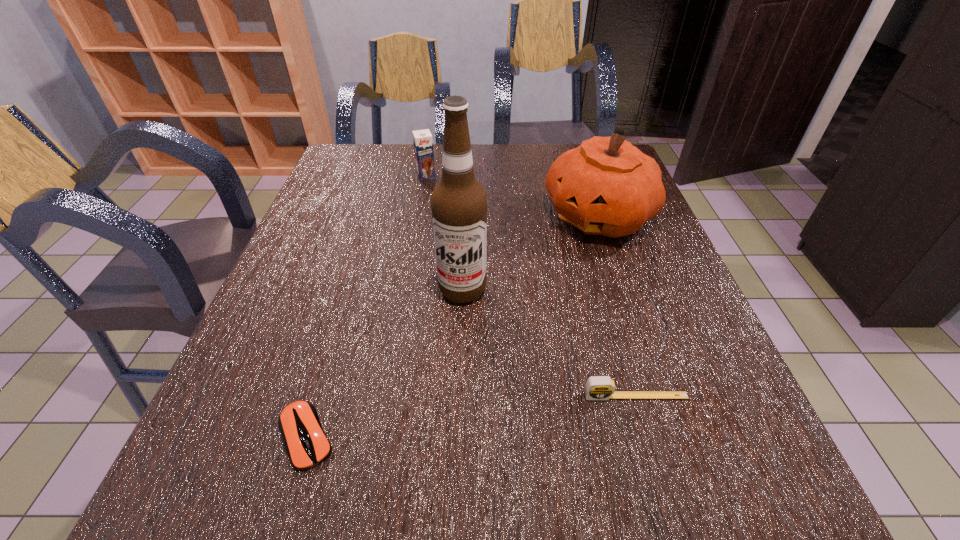
In order to click on free space on the desktop that is between the computer mouse and the fourth farthest object and is positioned on the front label of the chocolate milk in this screenshot , I will do `click(524, 410)`.

You are a GUI agent. You are given a task and a screenshot of the screen. Output one action in this format:
    pyautogui.click(x=<x>, y=<y>)
    Task: Click on the vacant space on the desktop that is between the shortest object and the second shortest object and is positioned on the label of the tallest object
    This screenshot has width=960, height=540.
    Given the screenshot: What is the action you would take?
    pyautogui.click(x=436, y=421)

Locate an element on the screen. This screenshot has height=540, width=960. free space on the desktop that is between the shortest object and the tape measure and is positioned on the front-facing side of the pumpkin is located at coordinates (475, 416).